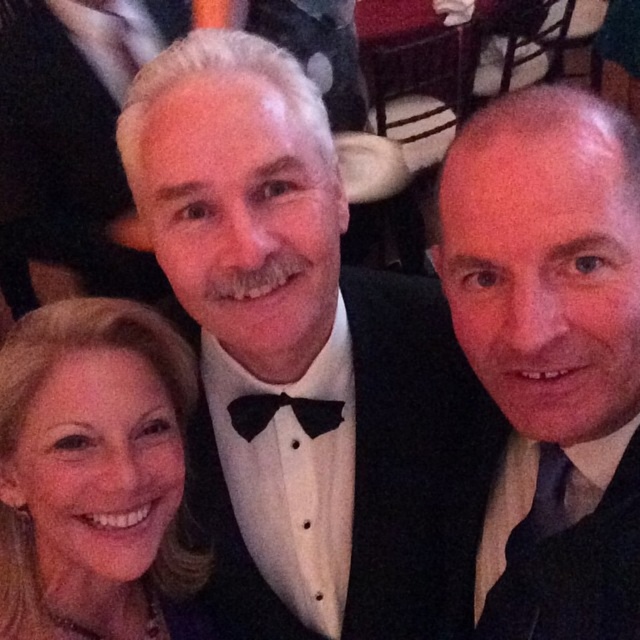
Which is in front, point (115, 420) or point (234, 428)?

Point (115, 420) is more forward.

The height and width of the screenshot is (640, 640). What do you see at coordinates (93, 476) in the screenshot?
I see `blonde hair at lower left` at bounding box center [93, 476].

Describe the element at coordinates (93, 476) in the screenshot. I see `blonde hair at lower left` at that location.

The image size is (640, 640). Find the location of `blonde hair at lower left`. blonde hair at lower left is located at coordinates (93, 476).

In the scene shown: Is black satin tuxedo at center shorter than black satin suit at center?

Incorrect, black satin tuxedo at center's height does not fall short of black satin suit at center's.

Between point (406, 516) and point (618, 216), which one is positioned in front?

Point (618, 216) is more forward.

Where is `black satin tuxedo at center`? black satin tuxedo at center is located at coordinates (307, 358).

This screenshot has width=640, height=640. In order to click on black satin tuxedo at center in this screenshot , I will do click(307, 358).

Which is behind, point (225, 259) or point (282, 394)?

Point (282, 394)

Is point (305, 474) closer to camera compared to point (262, 401)?

No, it is behind (262, 401).

Find the location of a particular element. This screenshot has width=640, height=640. black satin tuxedo at center is located at coordinates (307, 358).